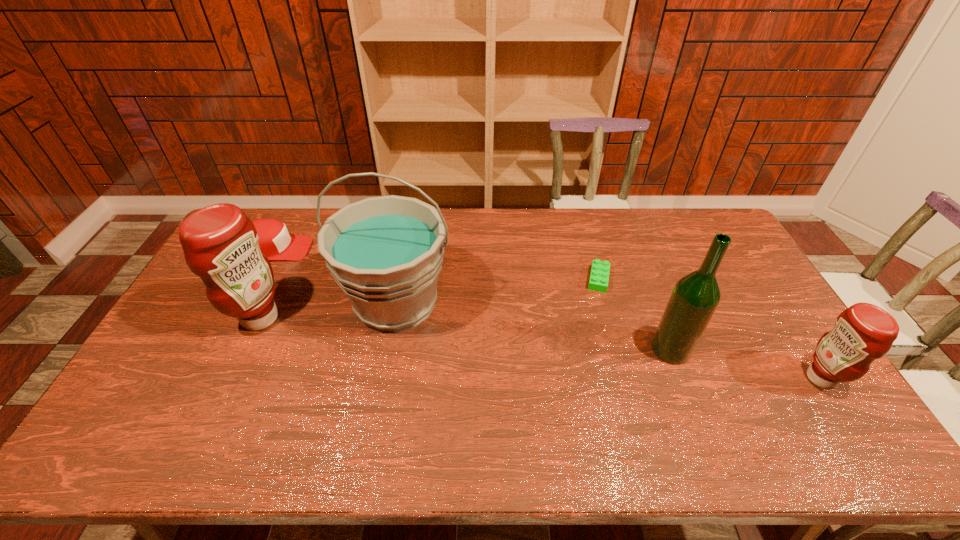
Locate an element on the screen. The height and width of the screenshot is (540, 960). vacant space that satisfies the following two spatial constraints: 1. on the back side of the shortest object; 2. on the front-facing side of the second shortest object is located at coordinates (590, 249).